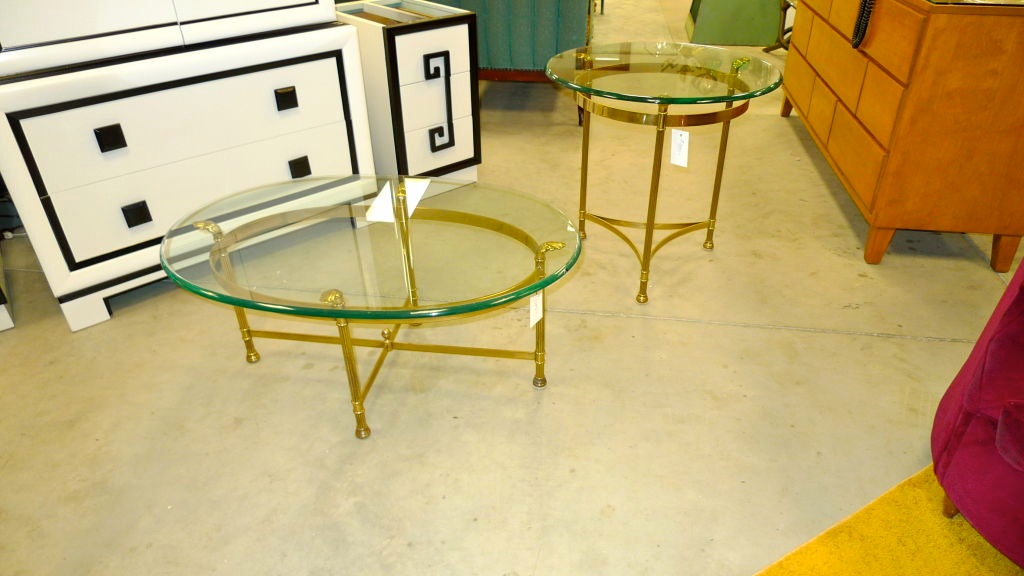
Locate an element on the screen. This screenshot has width=1024, height=576. shadow under dresser is located at coordinates (933, 250).